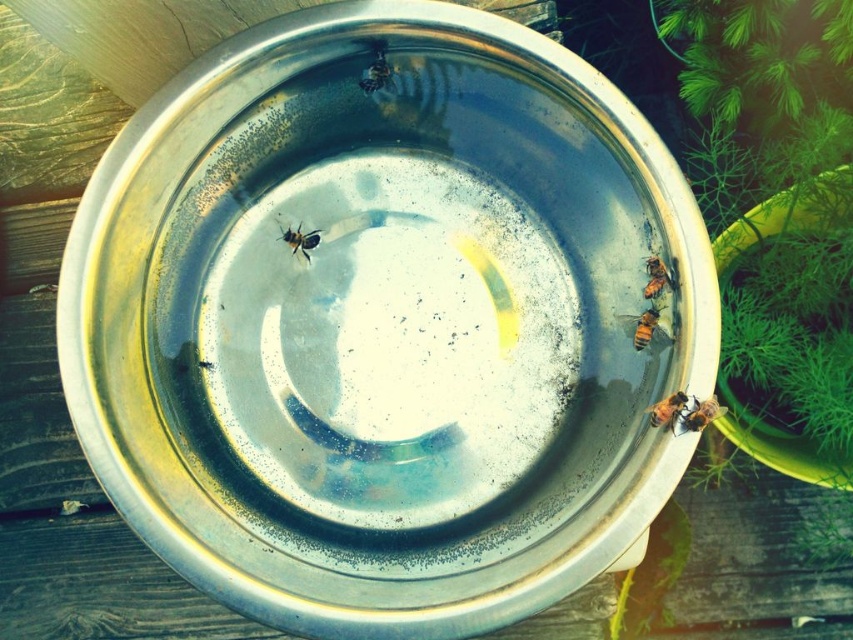
You are a beekeeper observing the bees around the metallic bowl. Which of the two bees, the translucent yellowish honeybee at right or the translucent yellowish honeybee at bottom right, is positioned higher up in the image?

The translucent yellowish honeybee at right is positioned higher up in the image because it is much taller than the translucent yellowish honeybee at bottom right.

You are a beekeeper observing the bees around the metallic bowl. You notice two specific bees, the translucent orange bee at right and the translucent yellowish honeybee at bottom right. Which of these two bees has a smaller body width?

Result: The translucent orange bee at right has a smaller body width than the translucent yellowish honeybee at bottom right.